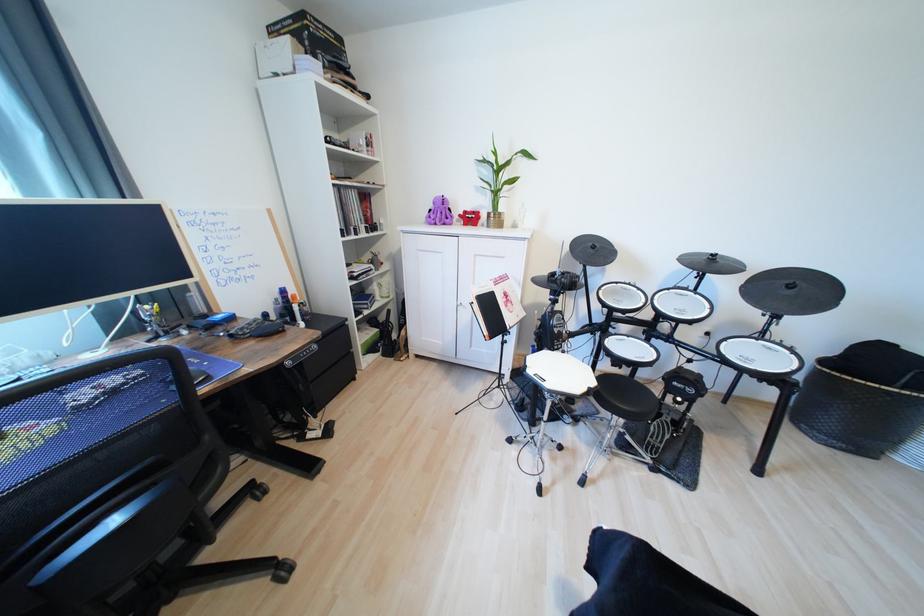
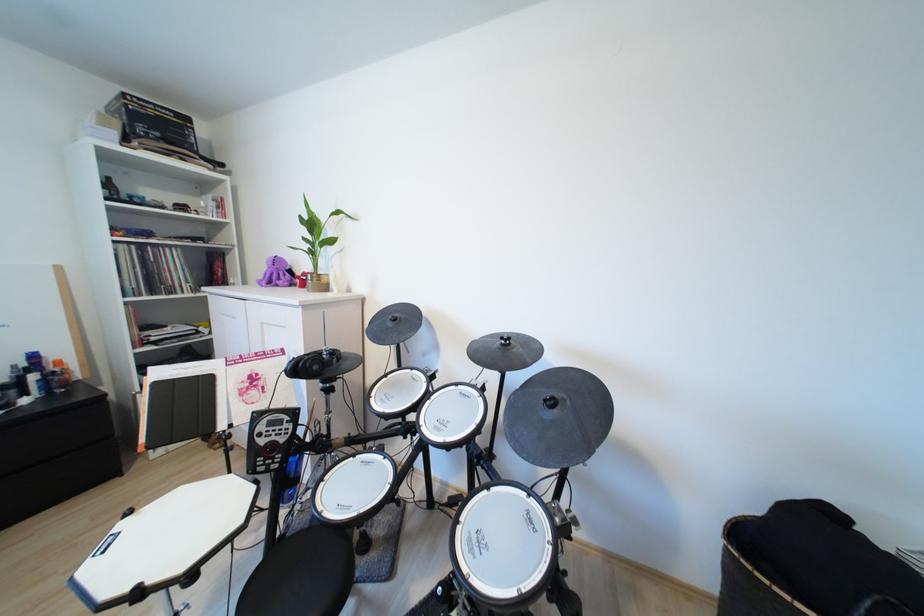
Find the pixel in the second image that matches [599,252] in the first image.

(396, 325)